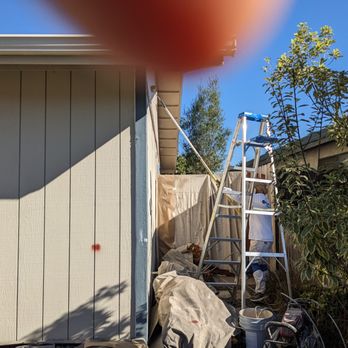
Where is `blue tray on ladder`? The image size is (348, 348). blue tray on ladder is located at coordinates (263, 138).